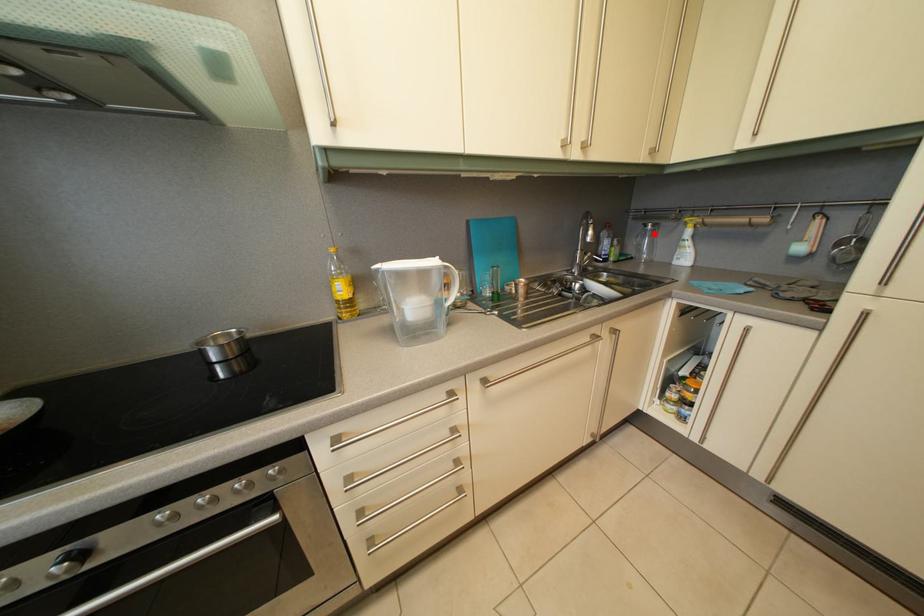
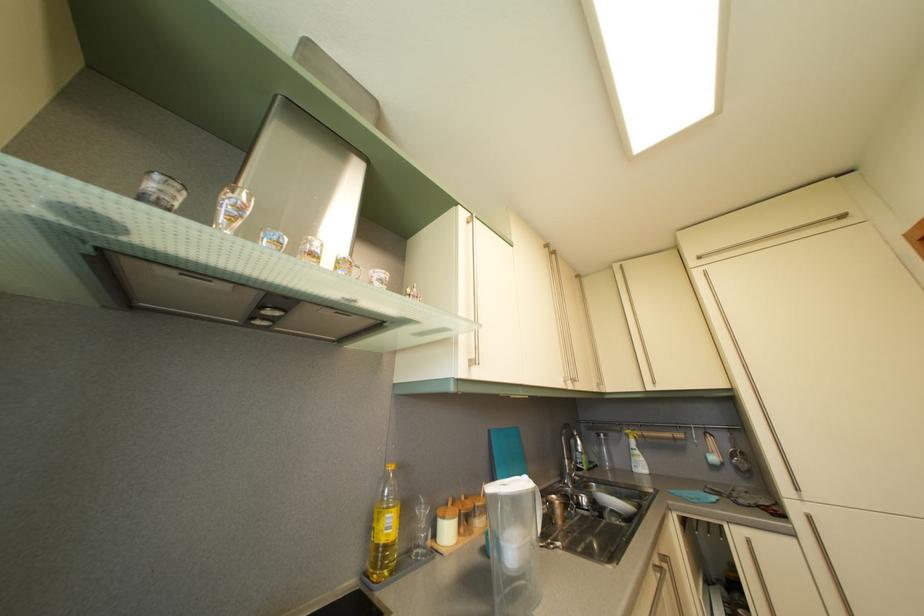
Question: A red point is marked in image1. In image2, is the corresponding 3D point closer to the camera or farther? Reply with the corresponding letter.

Choices:
 (A) The corresponding 3D point is closer.
 (B) The corresponding 3D point is farther.

Answer: (B)